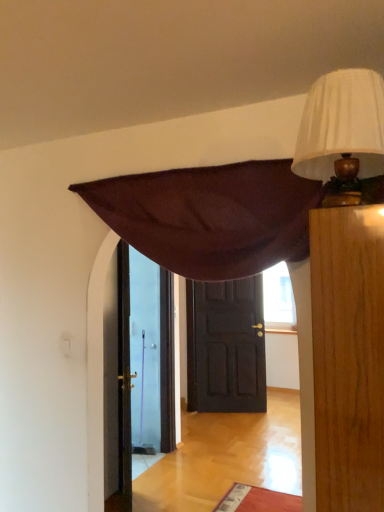
Question: In terms of height, does white pleated fabric lampshade at upper right look taller or shorter compared to dark brown wooden door at center?

Choices:
 (A) short
 (B) tall

Answer: (A)

Question: From a real-world perspective, relative to dark brown wooden door at center, is white pleated fabric lampshade at upper right vertically above or below?

Choices:
 (A) above
 (B) below

Answer: (A)

Question: From the image's perspective, is white pleated fabric lampshade at upper right positioned above or below dark brown wooden door at center?

Choices:
 (A) below
 (B) above

Answer: (B)

Question: In the image, is dark brown wooden door at center on the left side or the right side of white pleated fabric lampshade at upper right?

Choices:
 (A) right
 (B) left

Answer: (A)

Question: Is dark brown wooden door at center wider or thinner than white pleated fabric lampshade at upper right?

Choices:
 (A) wide
 (B) thin

Answer: (B)

Question: Relative to white pleated fabric lampshade at upper right, is dark brown wooden door at center in front or behind?

Choices:
 (A) behind
 (B) front

Answer: (A)

Question: Is point (203, 286) positioned closer to the camera than point (370, 157)?

Choices:
 (A) closer
 (B) farther

Answer: (B)